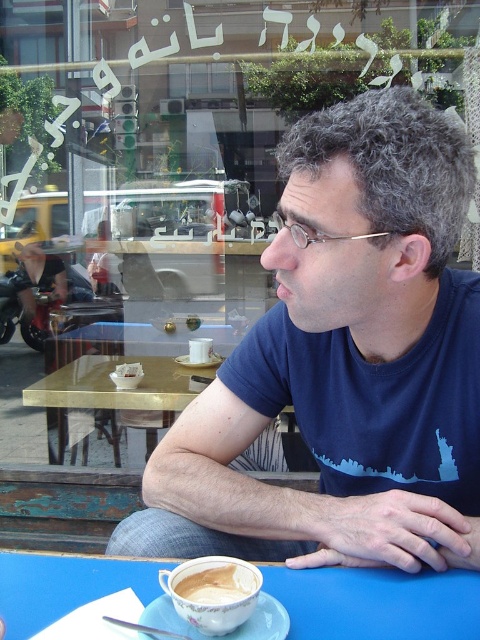
Question: Which point is farther to the camera?

Choices:
 (A) light brown ceramic cup at lower center
 (B) white ceramic cup at center
 (C) gold reflective table at center
 (D) white ceramic saucer at center

Answer: (B)

Question: Can you confirm if blue cotton shirt at center is bigger than porcelain saucer at lower center?

Choices:
 (A) no
 (B) yes

Answer: (B)

Question: Which object is positioned closest to the white ceramic saucer at center?

Choices:
 (A) porcelain saucer at lower center
 (B) blue matte table at lower center
 (C) gold reflective table at center
 (D) white ceramic cup at center

Answer: (D)

Question: Which of the following is the closest to the observer?

Choices:
 (A) porcelain saucer at lower center
 (B) light brown ceramic cup at lower center

Answer: (B)

Question: Is gold reflective table at center further to camera compared to white ceramic cup at center?

Choices:
 (A) yes
 (B) no

Answer: (B)

Question: In this image, where is porcelain saucer at lower center located relative to light brown ceramic cup at lower center?

Choices:
 (A) right
 (B) left

Answer: (B)